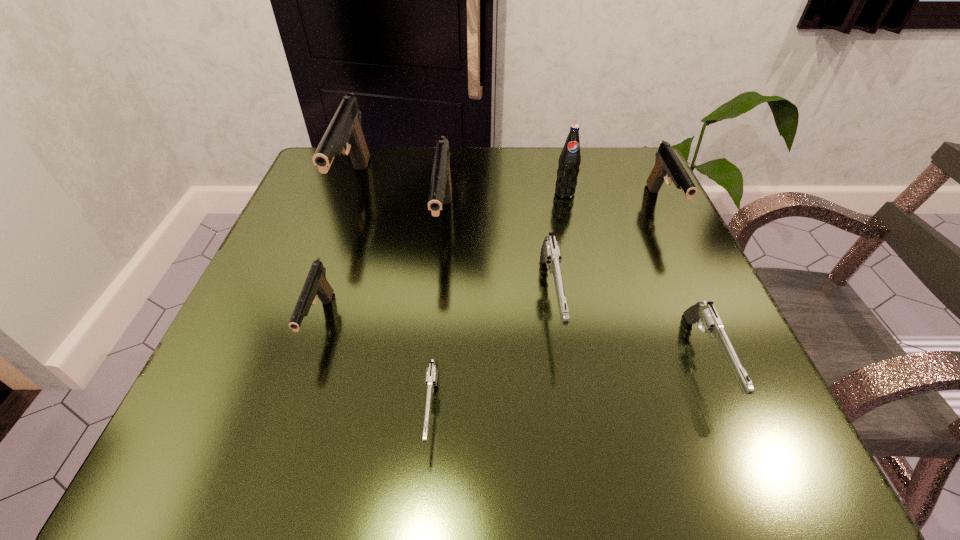
The height and width of the screenshot is (540, 960). What are the coordinates of `the fifth closest object to the third smallest black pistol` in the screenshot? It's located at (431, 374).

Identify which object is the third closest to the second tallest pistol. Please provide its 2D coordinates. Your answer should be formatted as a tuple, i.e. [(x, y)], where the tuple contains the x and y coordinates of a point satisfying the conditions above.

[(316, 285)]

Locate an element on the screen. The image size is (960, 540). pistol that is the sixth closest to the tallest pistol is located at coordinates (667, 164).

You are a GUI agent. You are given a task and a screenshot of the screen. Output one action in this format:
    pyautogui.click(x=<x>, y=<y>)
    Task: Click on the pistol that stands as the third closest to the biggest black pistol
    Image resolution: width=960 pixels, height=540 pixels.
    Given the screenshot: What is the action you would take?
    pyautogui.click(x=431, y=374)

Select which black pistol is the closest to the rightmost silver pistol. Please provide its 2D coordinates. Your answer should be formatted as a tuple, i.e. [(x, y)], where the tuple contains the x and y coordinates of a point satisfying the conditions above.

[(667, 164)]

This screenshot has width=960, height=540. Find the location of `the closest black pistol relative to the smallest silver pistol`. the closest black pistol relative to the smallest silver pistol is located at coordinates (316, 285).

The image size is (960, 540). In order to click on silver pistol that can be found as the third closest to the biggest black pistol in this screenshot , I will do `click(704, 314)`.

This screenshot has height=540, width=960. I want to click on silver pistol that stands as the second closest to the fourth object from right to left, so click(704, 314).